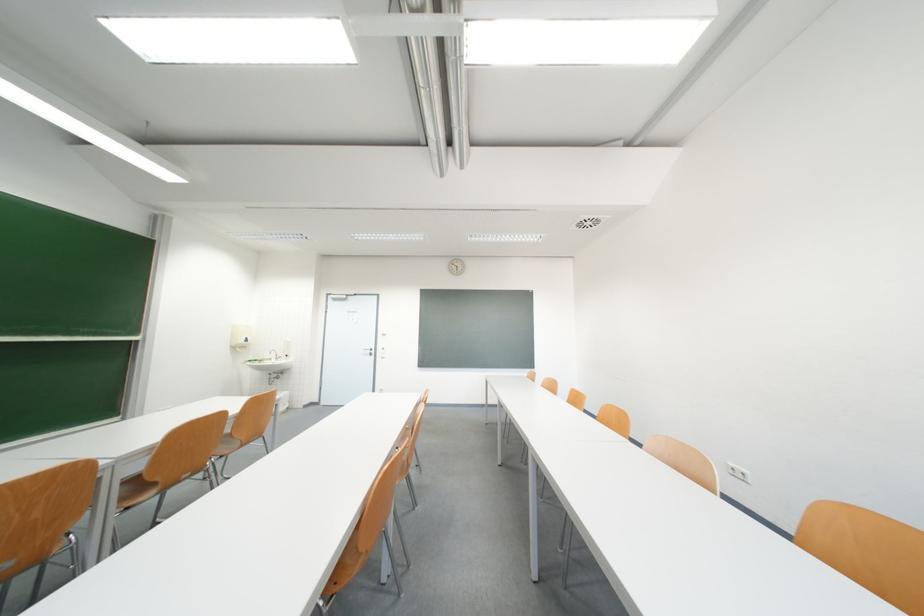
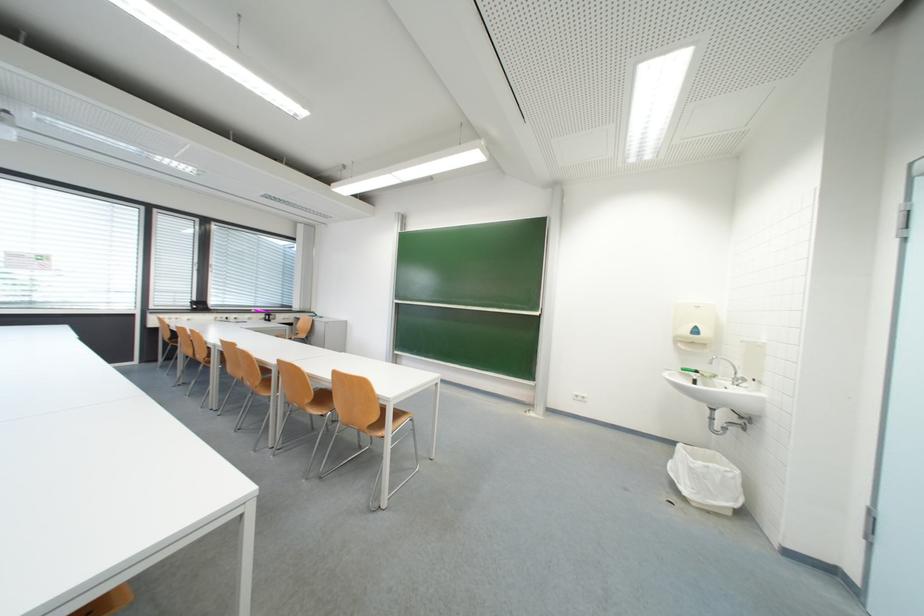
Locate, in the second image, the point that corresponds to [283,363] in the first image.

(736, 385)